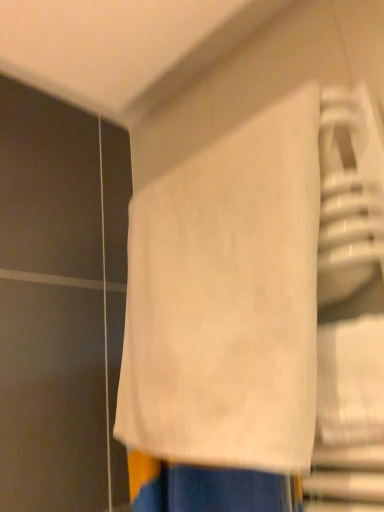
What is the approximate width of white cotton towel at center?

6.00 inches.

What do you see at coordinates (227, 300) in the screenshot? I see `white cotton towel at center` at bounding box center [227, 300].

I want to click on white cotton towel at center, so click(227, 300).

Locate an element on the screen. The image size is (384, 512). white cotton towel at center is located at coordinates (227, 300).